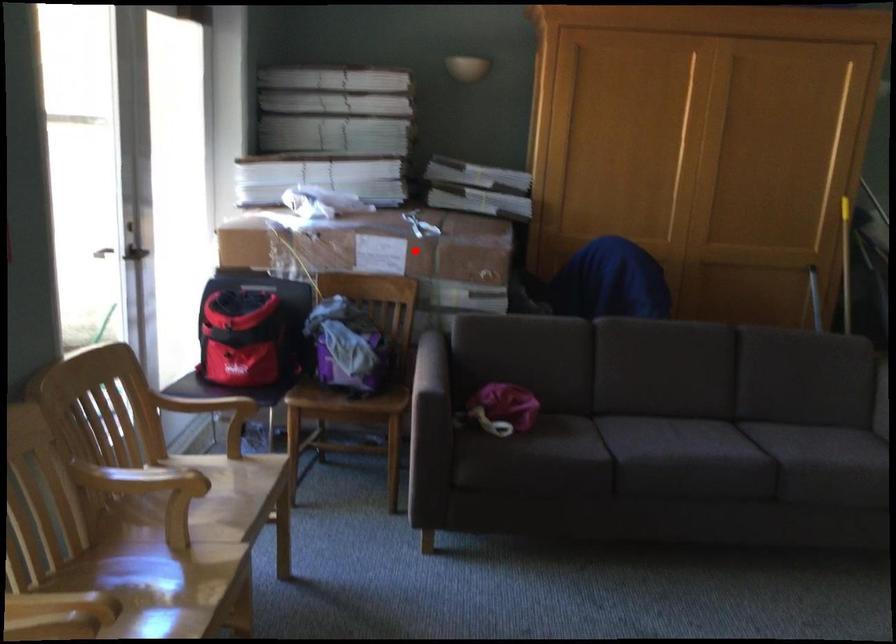
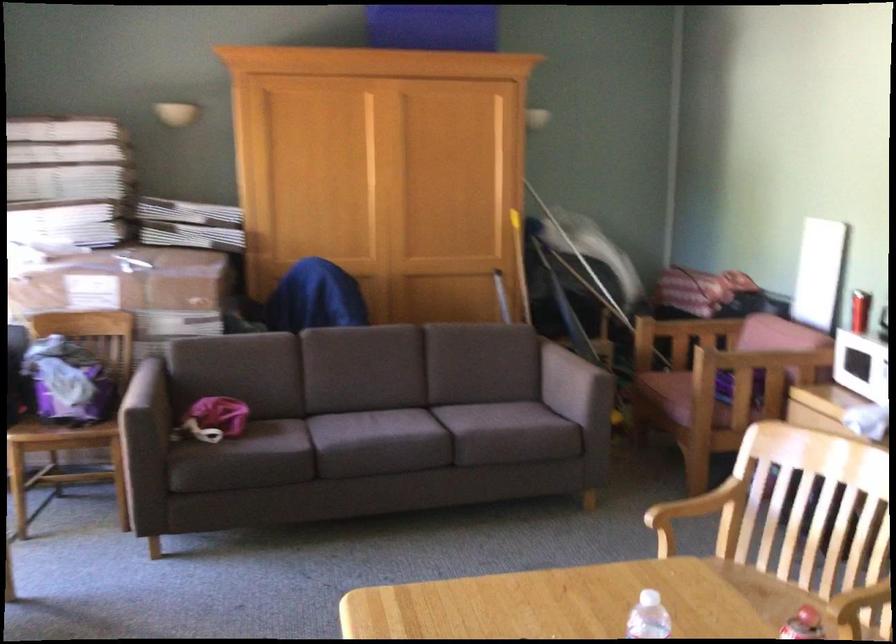
Where in the second image is the point corresponding to the highlighted location from the first image?

(131, 290)